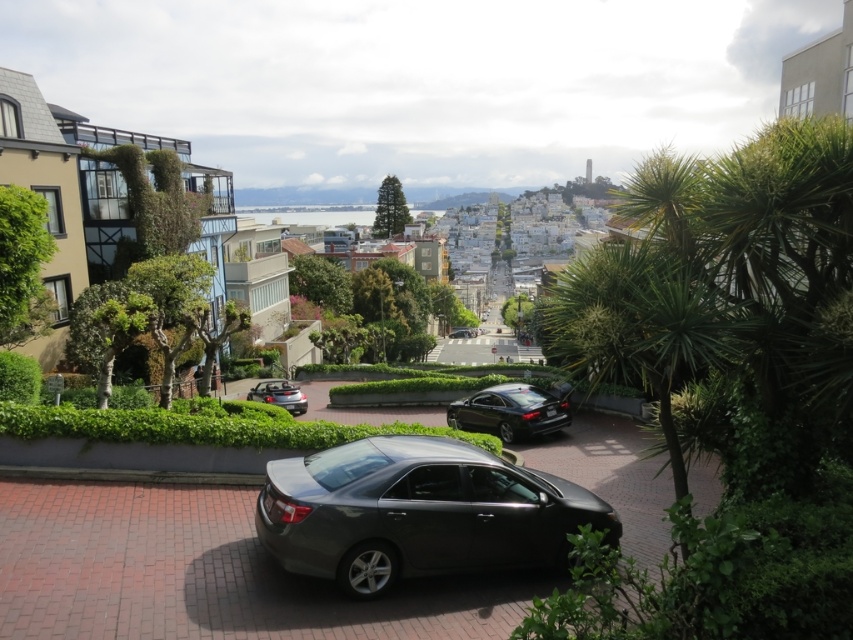
Question: Is satin black sedan at center wider than glossy black sedan at center?

Choices:
 (A) yes
 (B) no

Answer: (B)

Question: Which point appears closest to the camera in this image?

Choices:
 (A) (471, 336)
 (B) (502, 390)
 (C) (556, 522)

Answer: (C)

Question: Can you confirm if satin black sedan at center is positioned above shiny black sedan at center?

Choices:
 (A) yes
 (B) no

Answer: (B)

Question: Can you confirm if satin silver convertible at center is smaller than shiny black sedan at center?

Choices:
 (A) no
 (B) yes

Answer: (B)

Question: Which object is positioned closest to the satin black sedan at center?

Choices:
 (A) shiny black sedan at center
 (B) satin silver convertible at center

Answer: (B)

Question: Which of the following is the closest to the observer?

Choices:
 (A) (456, 330)
 (B) (613, 509)

Answer: (B)